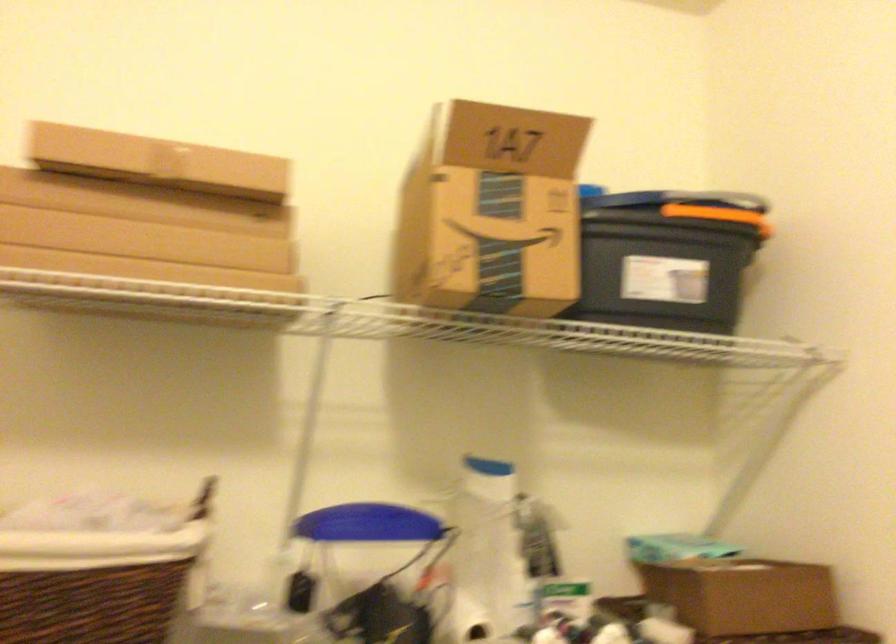
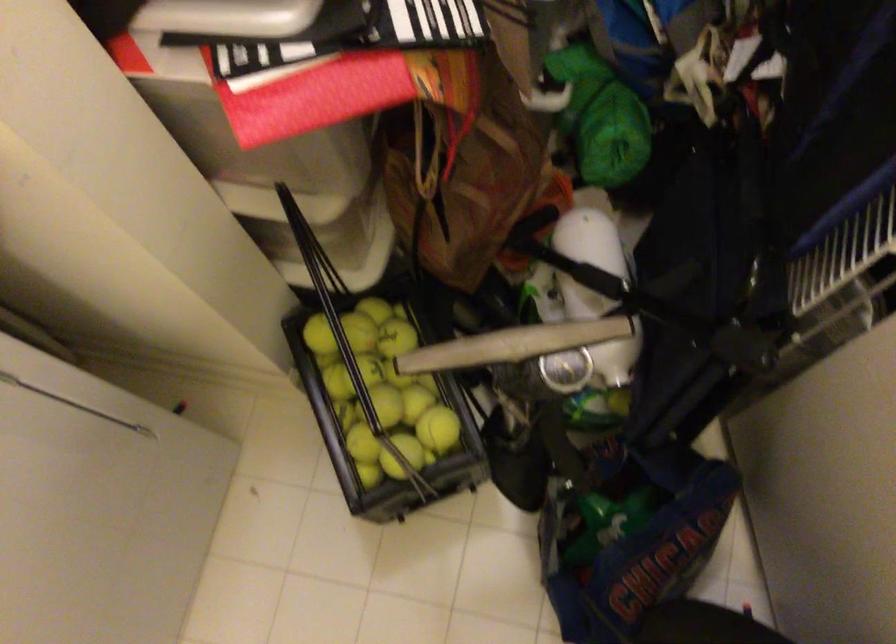
How did the camera likely rotate?

The camera's rotation is toward right-down.